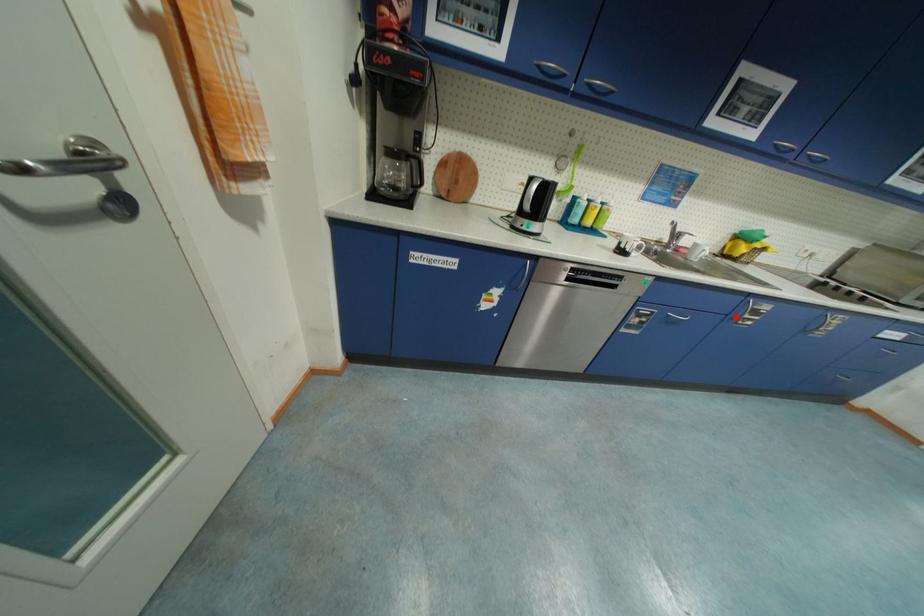
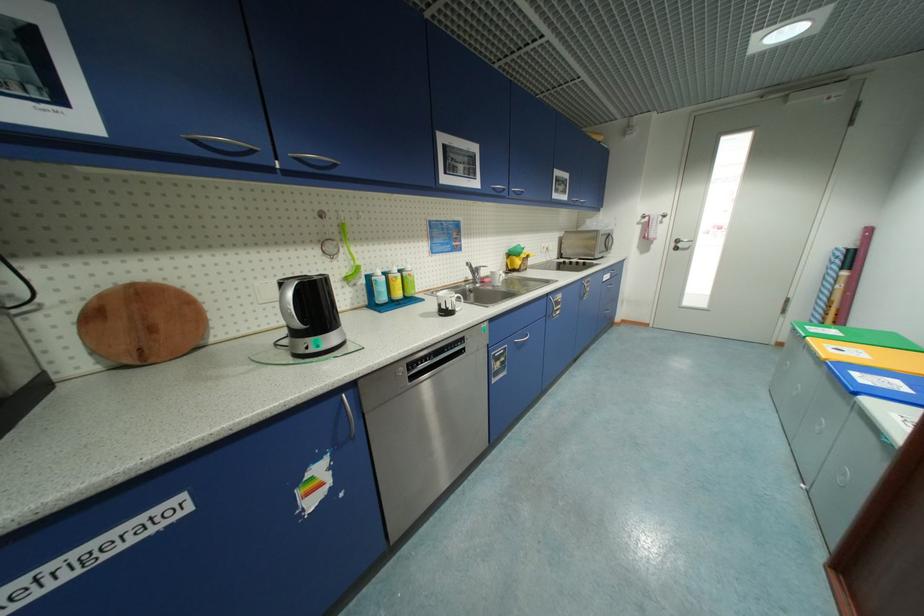
Question: I am providing you with two images of the same scene from different viewpoints. Image1 has a red point marked. In image2, the corresponding 3D location appears at what relative position? Reply with the corresponding letter.

Choices:
 (A) Closer
 (B) Farther

Answer: (B)